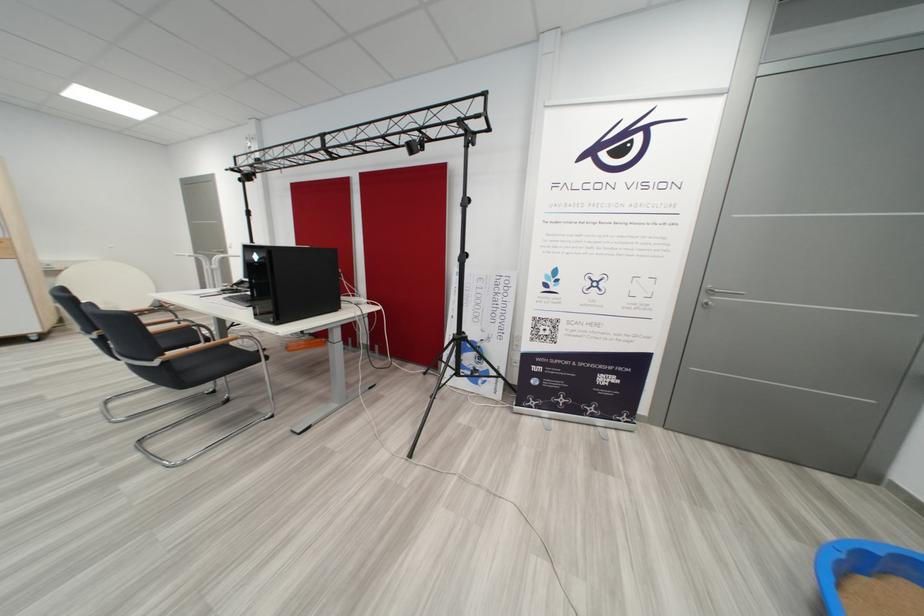
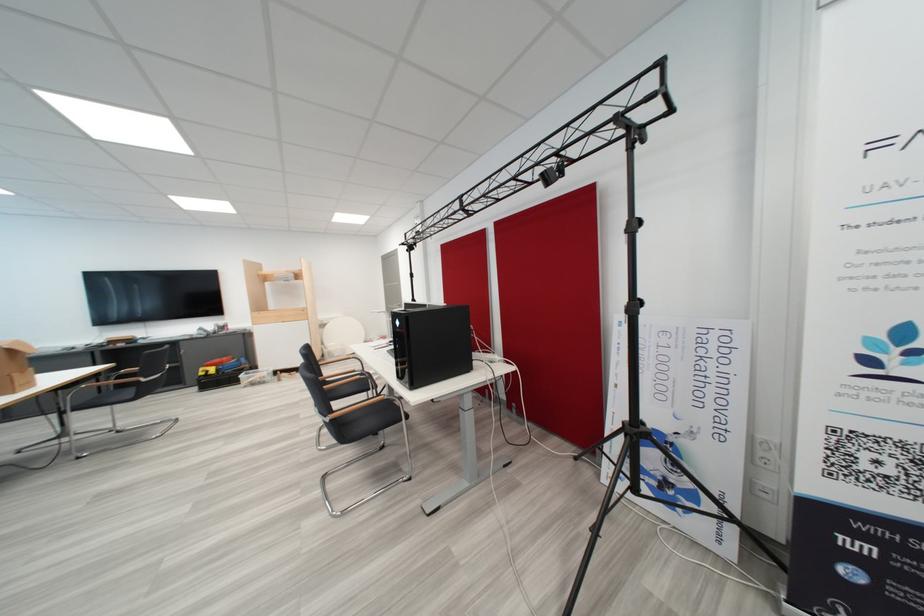
The point at (266,259) is marked in the first image. Where is the corresponding point in the second image?

(407, 325)